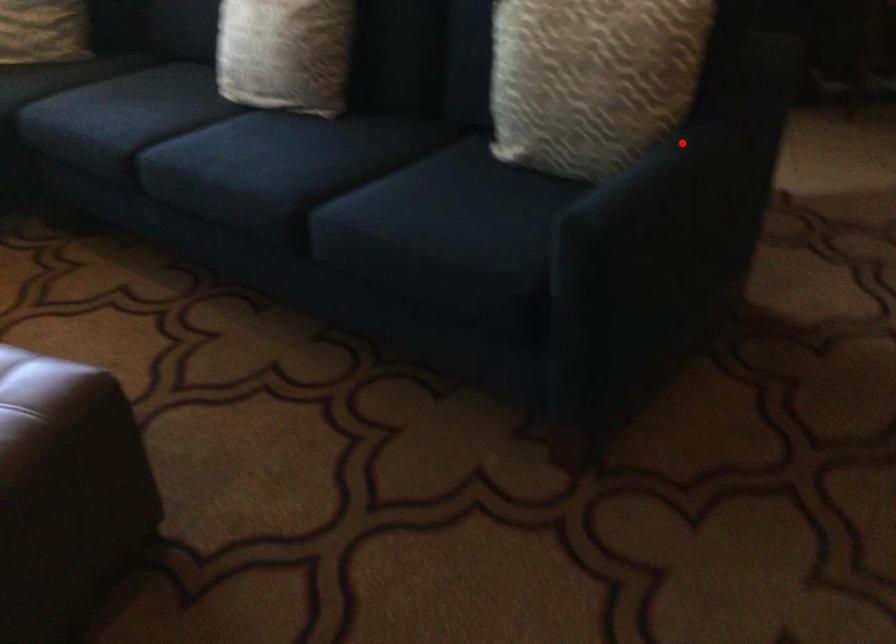
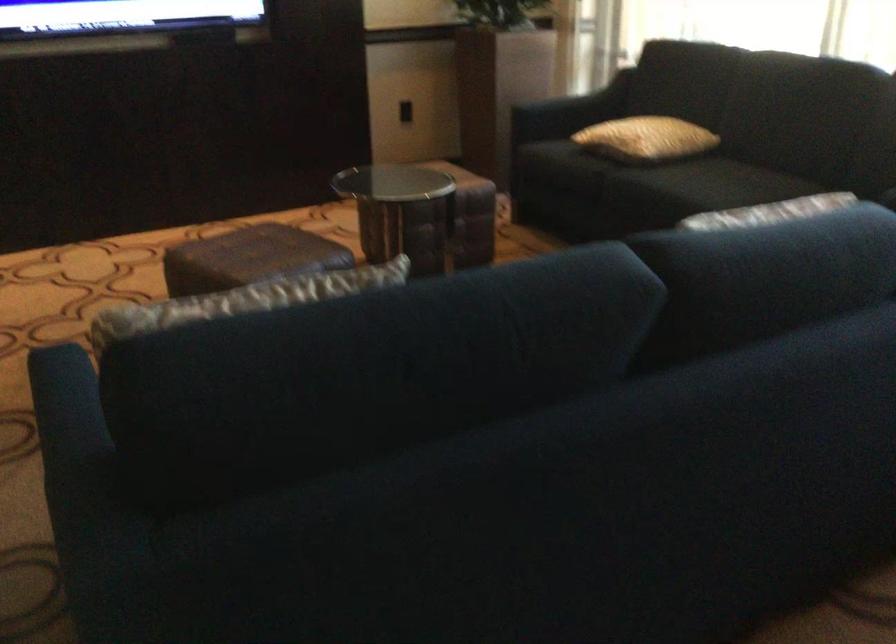
Question: I am providing you with two images of the same scene from different viewpoints. Given a red point in image1, look at the same physical point in image2. Is it:

Choices:
 (A) Closer to the viewpoint
 (B) Farther from the viewpoint

Answer: (A)